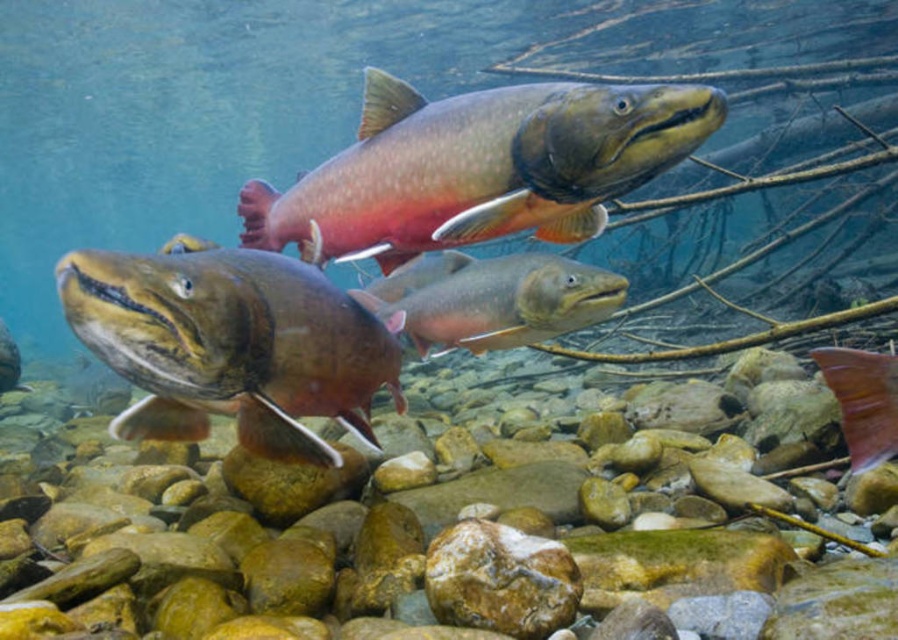
Question: Is smooth rock at center bigger than shiny pinkish salmon at center?

Choices:
 (A) no
 (B) yes

Answer: (B)

Question: Which object appears closest to the camera in this image?

Choices:
 (A) shiny orange fish at lower right
 (B) shiny pinkish-orange fish at center
 (C) smooth rock at center
 (D) shiny pinkish-silver fish at center

Answer: (A)

Question: Is shiny pinkish-orange fish at center positioned at the back of shiny pinkish salmon at center?

Choices:
 (A) no
 (B) yes

Answer: (A)

Question: Considering the real-world distances, which object is closest to the shiny pinkish salmon at center?

Choices:
 (A) shiny brown fish at center
 (B) shiny pinkish-orange fish at center

Answer: (A)

Question: Estimate the real-world distances between objects in this image. Which object is farther from the shiny pinkish salmon at center?

Choices:
 (A) shiny pinkish-silver fish at center
 (B) shiny pinkish-orange fish at center

Answer: (B)

Question: Is shiny brown fish at center positioned behind shiny pinkish-silver fish at center?

Choices:
 (A) no
 (B) yes

Answer: (A)